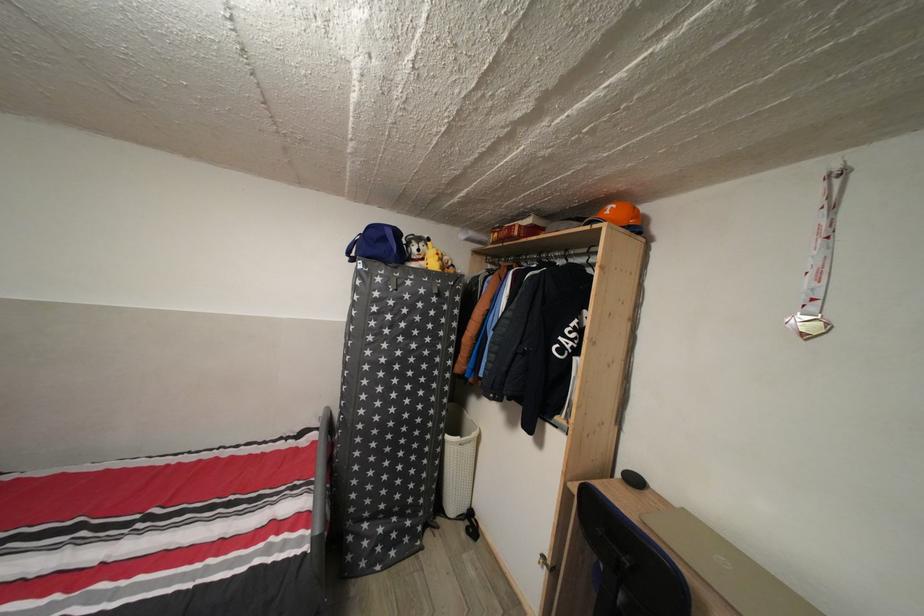
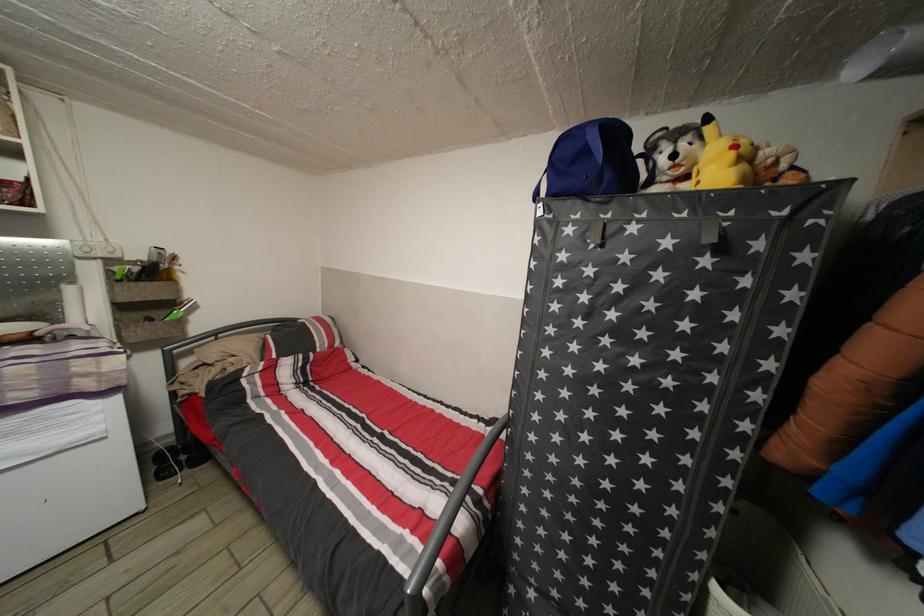
Find the pixel in the second image that matches (444,264) in the first image.

(738, 161)